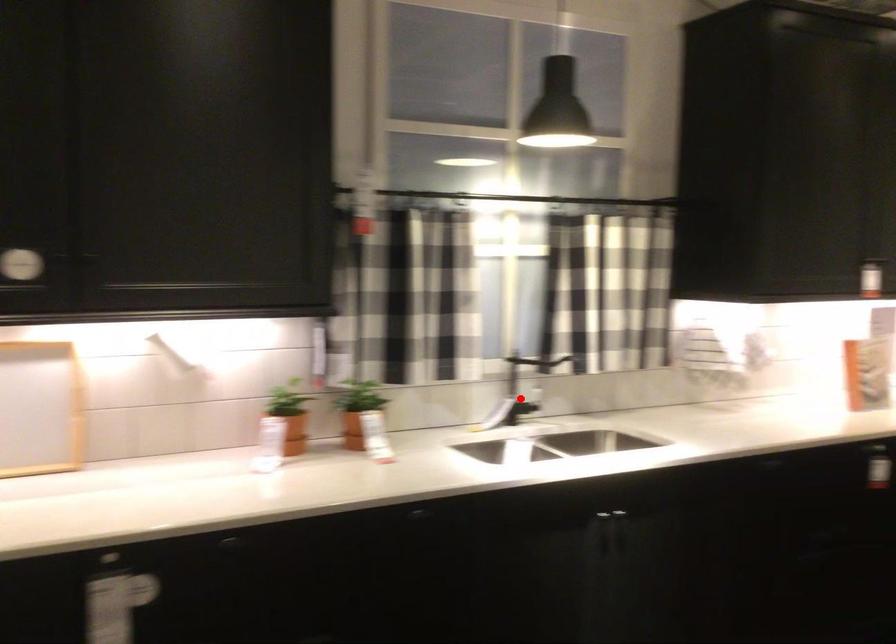
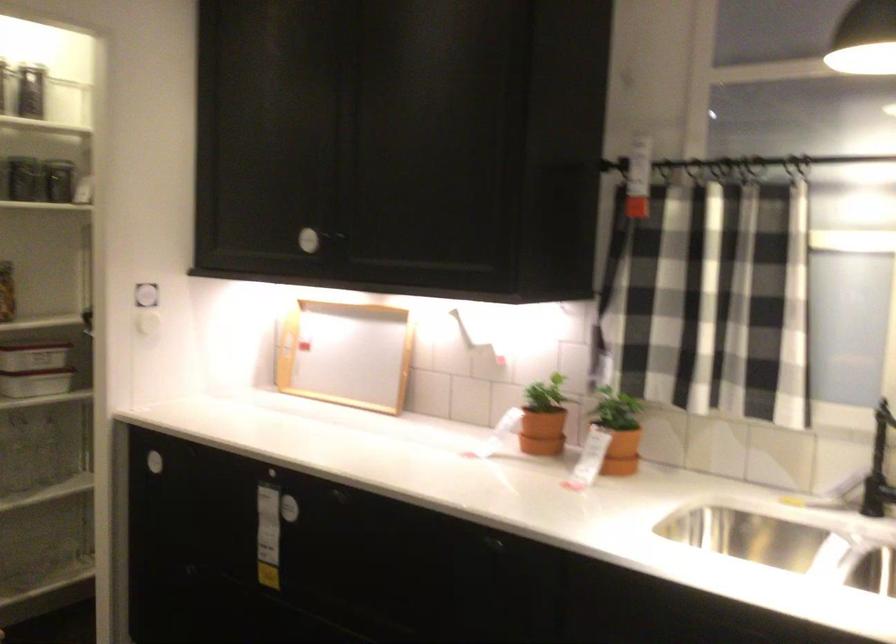
The point at the highlighted location is marked in the first image. Where is the corresponding point in the second image?

(879, 468)